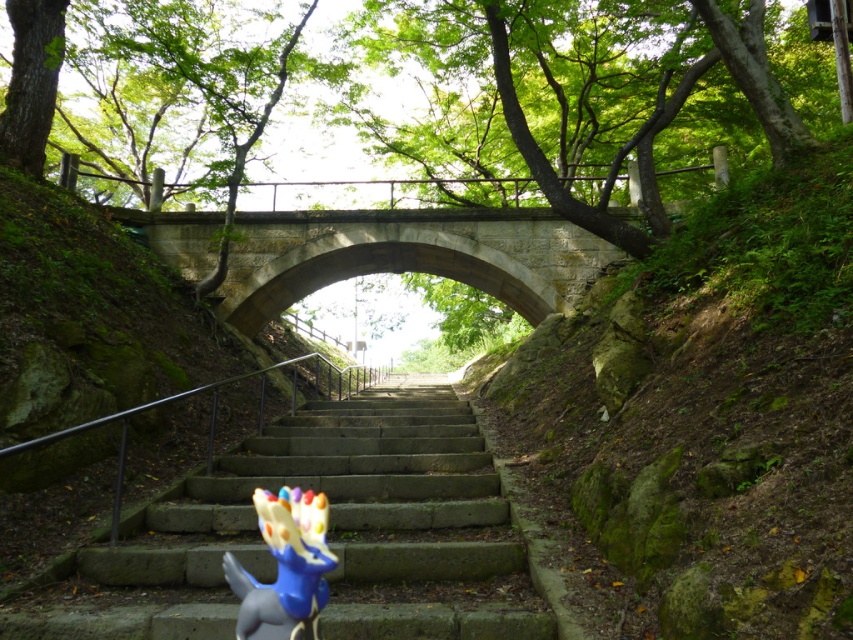
Does green mossy rock at upper right appear on the right side of stone stairs at center?

Indeed, green mossy rock at upper right is positioned on the right side of stone stairs at center.

Which of these two, green mossy rock at upper right or stone stairs at center, stands shorter?

stone stairs at center

Is point (734, 577) less distant than point (114, 595)?

Yes, it is.

Identify the location of green mossy rock at upper right. (708, 412).

Between green mossy rock at upper right and stone bridge at center, which one has less height?

Standing shorter between the two is stone bridge at center.

Who is taller, green mossy rock at upper right or stone bridge at center?

green mossy rock at upper right is taller.

Between point (708, 216) and point (427, 211), which one is positioned behind?

The point (427, 211) is behind.

Identify the location of green mossy rock at upper right. The image size is (853, 640). (708, 412).

Does stone bridge at center appear on the left side of blue rubber dinosaur at center?

In fact, stone bridge at center is to the right of blue rubber dinosaur at center.

At what (x,y) coordinates should I click in order to perform the action: click on stone bridge at center. Please return your answer as a coordinate pair (x, y). This screenshot has width=853, height=640. Looking at the image, I should click on (409, 256).

The width and height of the screenshot is (853, 640). I want to click on stone bridge at center, so click(x=409, y=256).